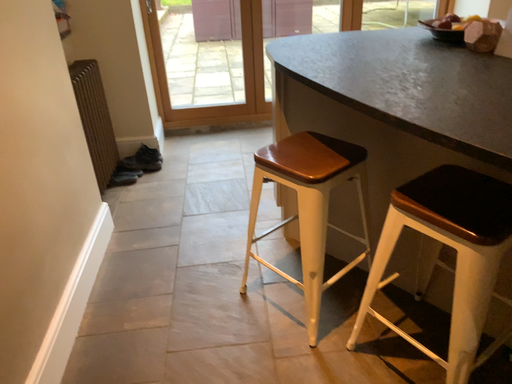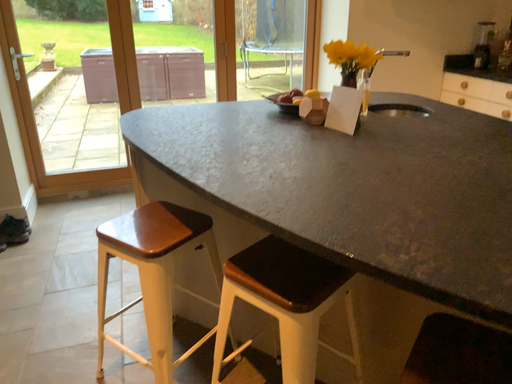
Question: How did the camera likely rotate when shooting the video?

Choices:
 (A) rotated right
 (B) rotated left

Answer: (A)